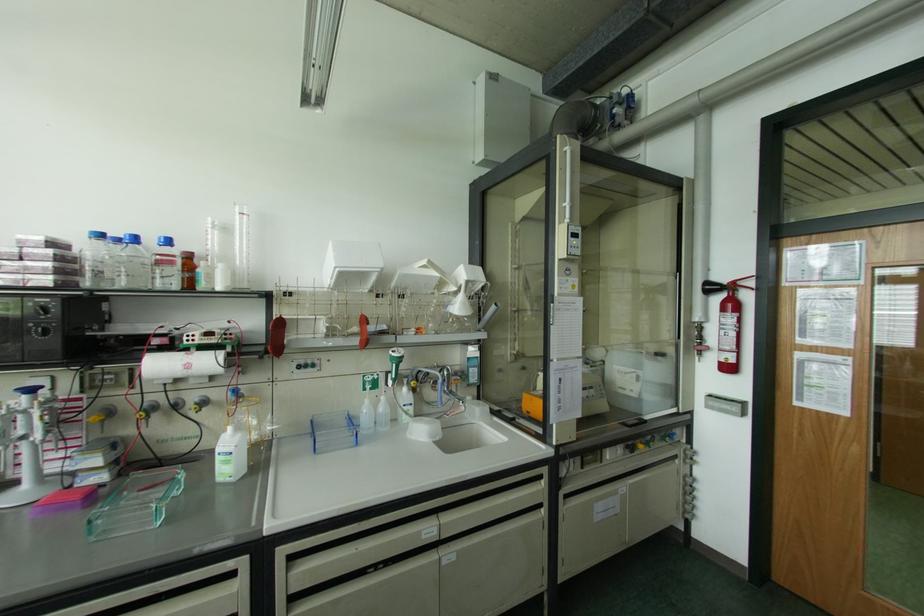
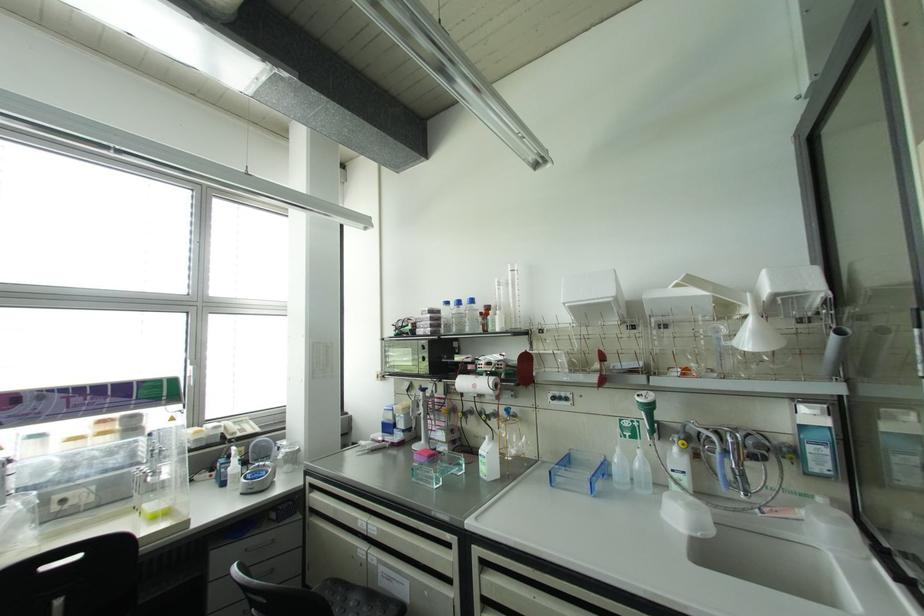
Find the pixel in the second image that matches point (188, 366) in the first image.

(473, 386)